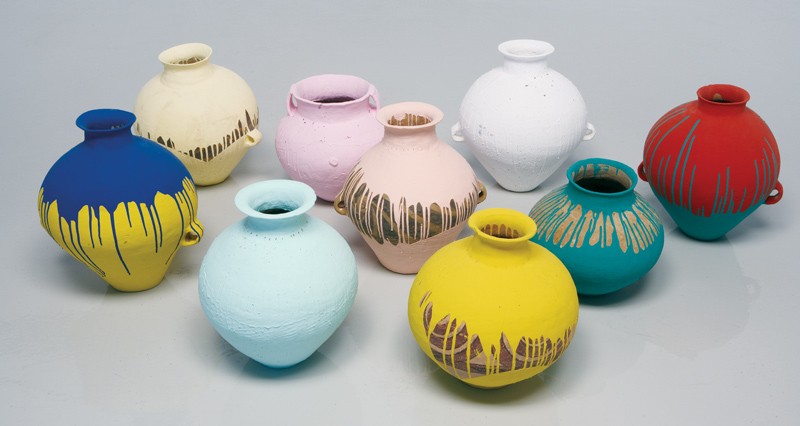
Where is `vase`? This screenshot has width=800, height=426. vase is located at coordinates (208, 120).